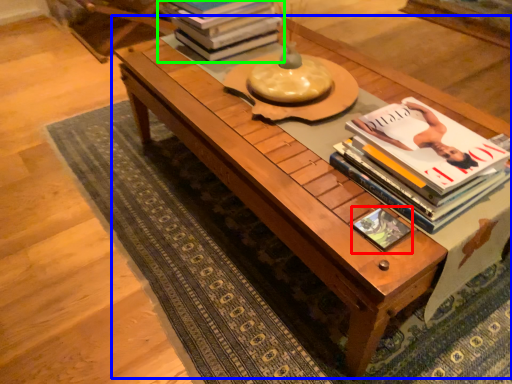
Question: Which object is the farthest from book cover (highlighted by a red box)? Choose among these: table (highlighted by a blue box) or book (highlighted by a green box).

Choices:
 (A) table
 (B) book

Answer: (B)